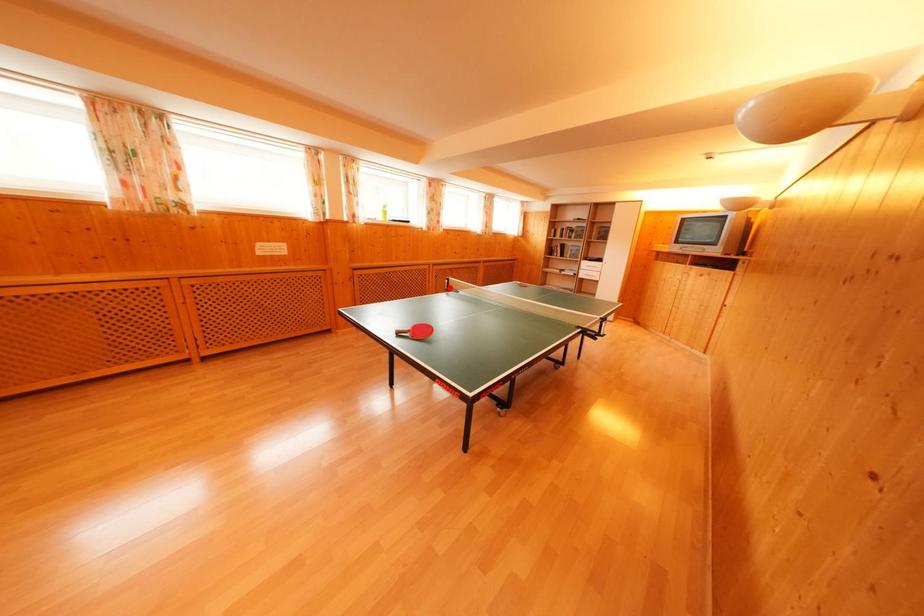
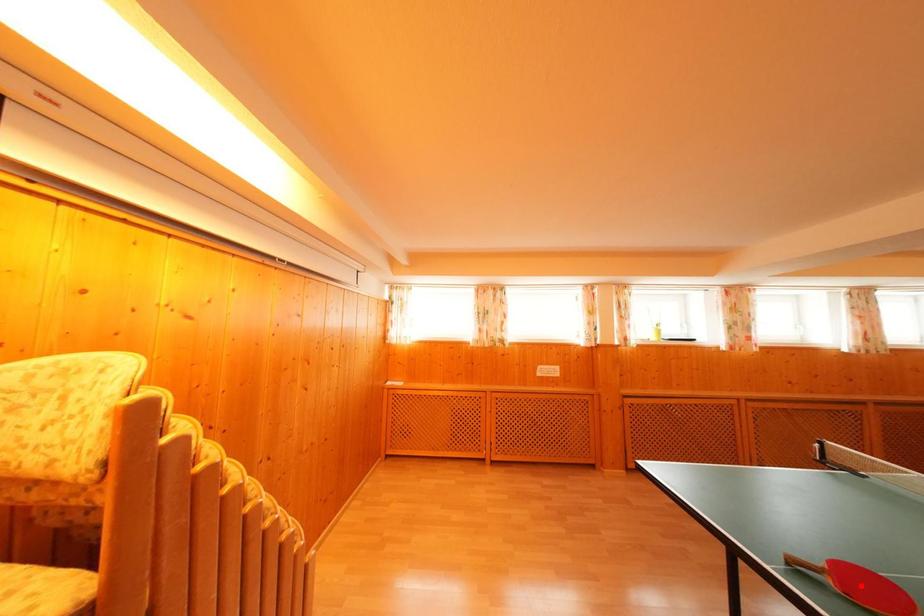
I am providing you with two images of the same scene from different viewpoints. A red point is marked on the first image and another point is marked on the second image. Are the points marked in image1 and image2 representing the same 3D position?

No